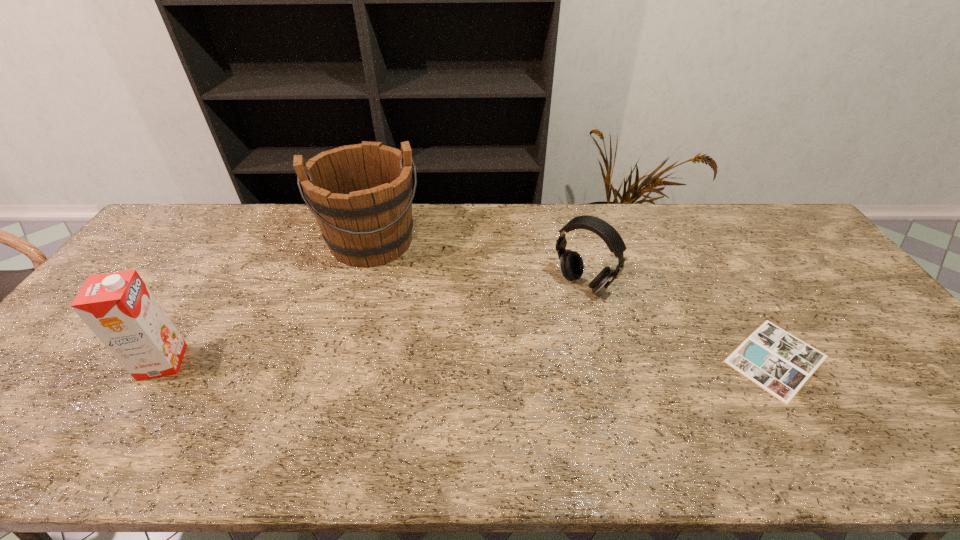
At what (x,y) coordinates should I click in order to perform the action: click on free space on the desktop that is between the carton and the book and is positioned on the ear cups of the earphone. Please return your answer as a coordinate pair (x, y). This screenshot has height=540, width=960. Looking at the image, I should click on pyautogui.click(x=511, y=360).

Where is `vacant spot on the desktop that is between the carton and the rightmost object and is positioned on the side of the third object from right to left with the handle for carrying`? Image resolution: width=960 pixels, height=540 pixels. vacant spot on the desktop that is between the carton and the rightmost object and is positioned on the side of the third object from right to left with the handle for carrying is located at coordinates (394, 361).